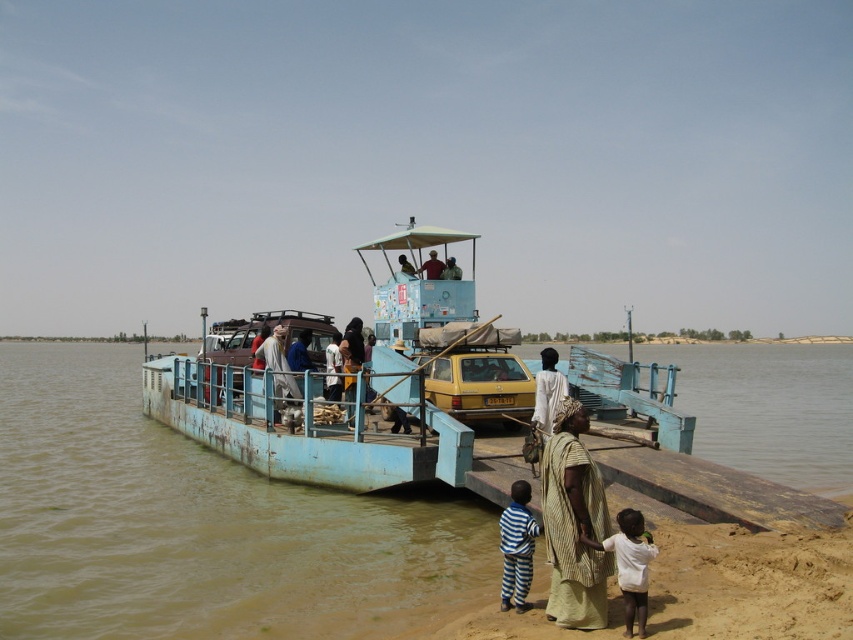
Question: Estimate the real-world distances between objects in this image. Which object is closer to the striped fabric dress at lower center?

Choices:
 (A) light brown fabric cloth at center
 (B) light brown fabric headscarf at center

Answer: (A)

Question: Does brown sedimentary river at center lie behind striped fabric dress at lower center?

Choices:
 (A) no
 (B) yes

Answer: (B)

Question: Among these objects, which one is nearest to the camera?

Choices:
 (A) brown sedimentary river at center
 (B) striped fabric dress at lower center
 (C) light brown fabric headscarf at center
 (D) light brown fabric shirt at center

Answer: (B)

Question: Is wooden dock at lower right wider than light brown wooden pole at upper center?

Choices:
 (A) no
 (B) yes

Answer: (B)

Question: Does blue painted wood boat at center have a greater width compared to light brown wooden pole at upper center?

Choices:
 (A) no
 (B) yes

Answer: (B)

Question: Among these points, which one is nearest to the camera?

Choices:
 (A) (315, 451)
 (B) (563, 593)

Answer: (B)